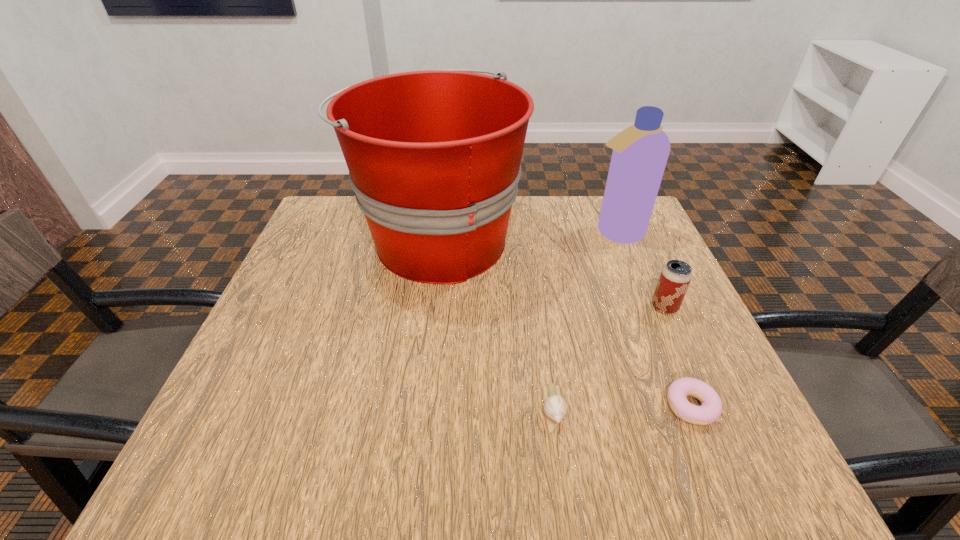
Locate an element on the screen. bucket is located at coordinates (434, 157).

The height and width of the screenshot is (540, 960). In order to click on shampoo in this screenshot , I will do `click(640, 152)`.

At what (x,y) coordinates should I click in order to perform the action: click on beer can. Please return your answer as a coordinate pair (x, y). Looking at the image, I should click on (675, 277).

Find the location of a particular element. The height and width of the screenshot is (540, 960). escargot is located at coordinates (555, 407).

Identify the location of the shortest object. The image size is (960, 540). (710, 410).

Locate an element on the screen. The height and width of the screenshot is (540, 960). vacant space located on the right of the bucket is located at coordinates (597, 240).

The image size is (960, 540). Identify the location of vacant point located 0.170m on the left of the shampoo. (520, 233).

Locate an element on the screen. free region located on the left of the beer can is located at coordinates (524, 307).

Identify the location of vacant space situated 0.210m on the back of the doughnut. The height and width of the screenshot is (540, 960). (649, 303).

At what (x,y) coordinates should I click in order to perform the action: click on bucket located in the far edge section of the desktop. Please return your answer as a coordinate pair (x, y). This screenshot has height=540, width=960. Looking at the image, I should click on (434, 157).